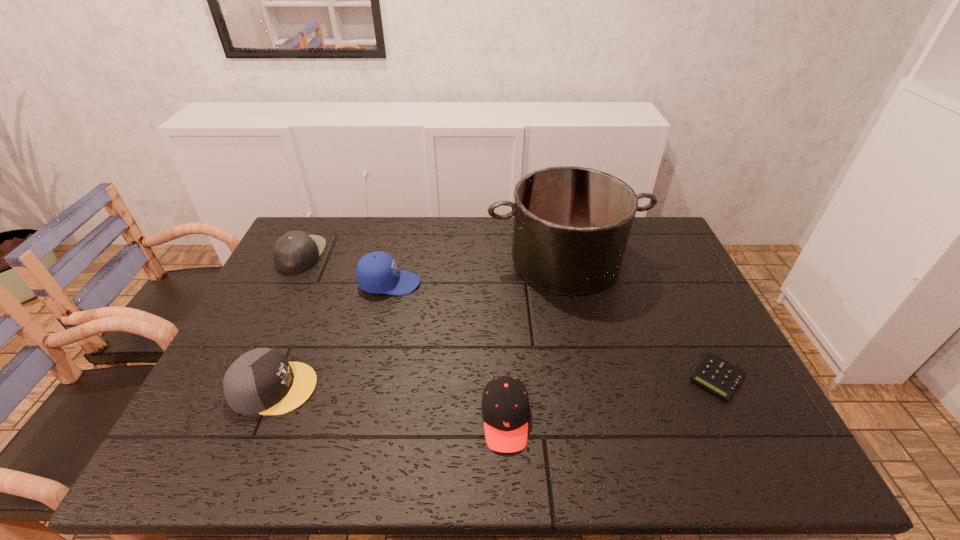
Find the location of a particular element. The image size is (960, 540). object that is at the near edge is located at coordinates (505, 406).

Where is `pan at the right edge`? The height and width of the screenshot is (540, 960). pan at the right edge is located at coordinates (571, 227).

You are a GUI agent. You are given a task and a screenshot of the screen. Output one action in this format:
    pyautogui.click(x=<x>, y=<y>)
    Task: Click on the calculator that is at the right edge
    Image resolution: width=960 pixels, height=540 pixels.
    Given the screenshot: What is the action you would take?
    pyautogui.click(x=715, y=374)

This screenshot has width=960, height=540. Identify the location of object that is at the far left corner. (296, 251).

Find the location of `object that is at the far right corner`. object that is at the far right corner is located at coordinates (571, 227).

Locate an element on the screen. The image size is (960, 540). vacant position at the far edge of the desktop is located at coordinates (368, 241).

Find the location of a particular element. vacant point at the near edge is located at coordinates (259, 454).

Find the location of `free space at the left edge`. free space at the left edge is located at coordinates (302, 274).

At what (x,y) coordinates should I click in order to perform the action: click on vacant area at the right edge. Please return your answer as a coordinate pair (x, y). Image resolution: width=960 pixels, height=540 pixels. Looking at the image, I should click on tap(648, 286).

Image resolution: width=960 pixels, height=540 pixels. I want to click on vacant space at the far left corner, so click(301, 226).